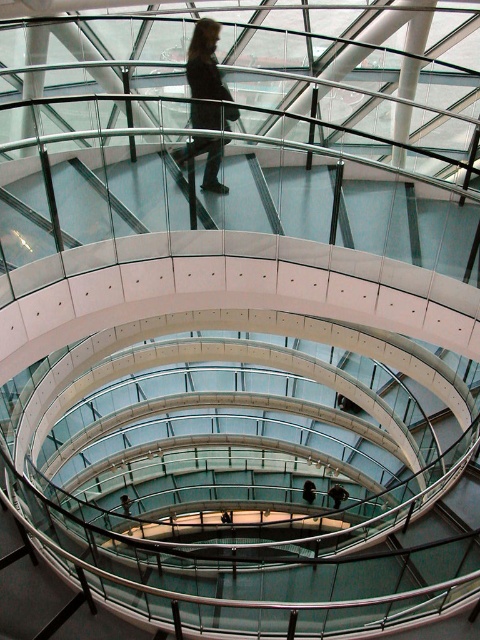
Is dark brown leather jacket at center thinner than dark brown leather jacket at upper center?

Indeed, dark brown leather jacket at center has a lesser width compared to dark brown leather jacket at upper center.

Who is more distant from viewer, [176,148] or [336,500]?

The point [336,500] is more distant.

This screenshot has width=480, height=640. Find the location of `dark brown leather jacket at center`. dark brown leather jacket at center is located at coordinates (204, 61).